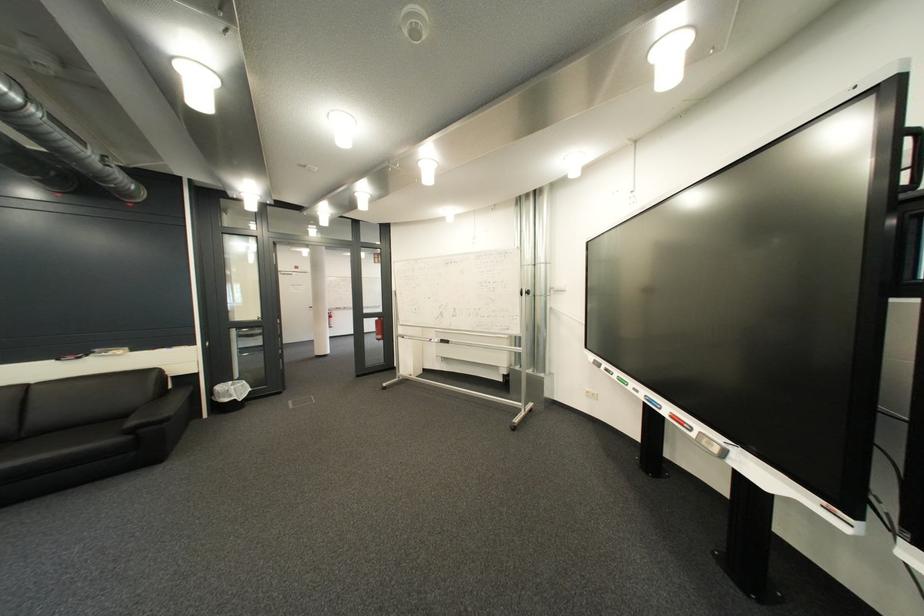
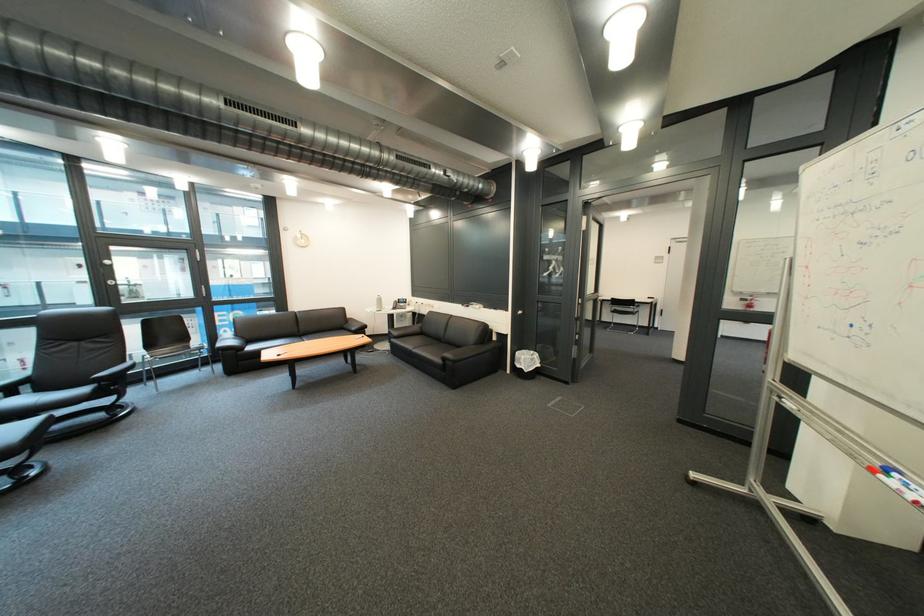
The point at [208,345] is marked in the first image. Where is the corresponding point in the second image?

(520, 312)